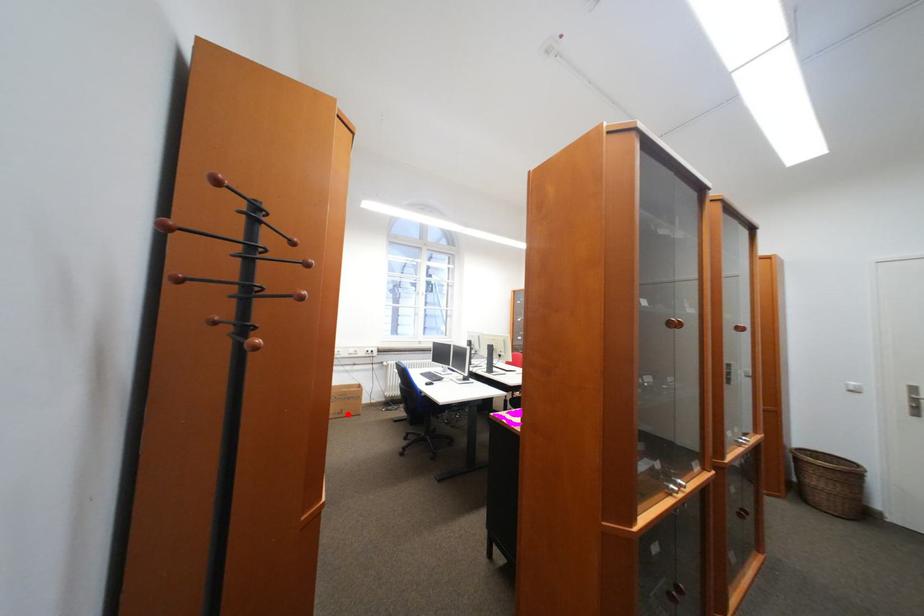
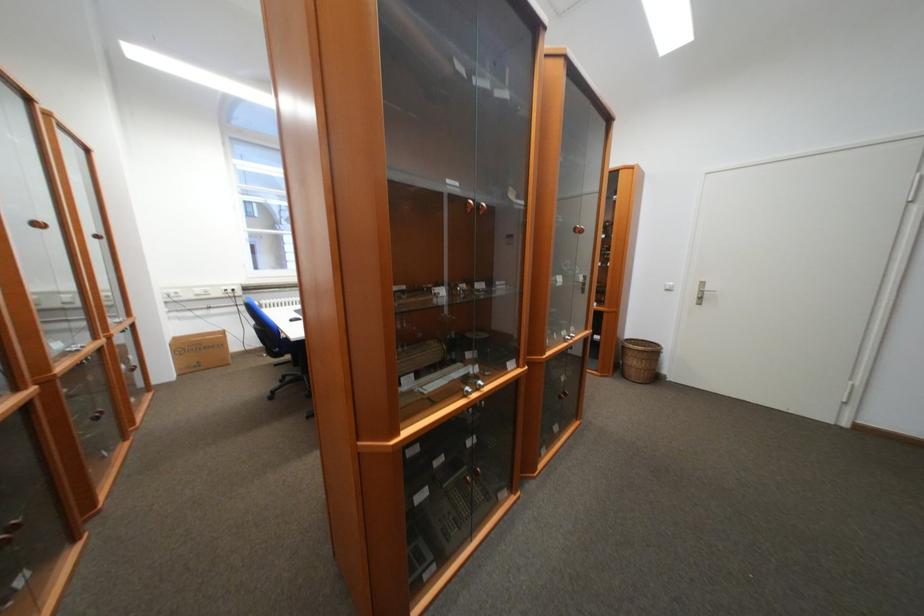
Find the pixel in the second image that matches the highlighted location in the first image.

(204, 368)